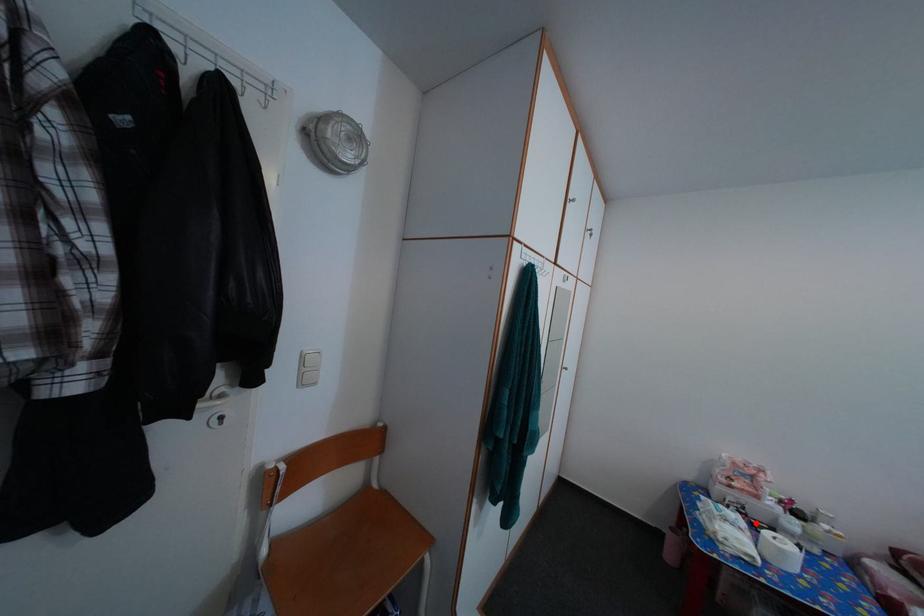
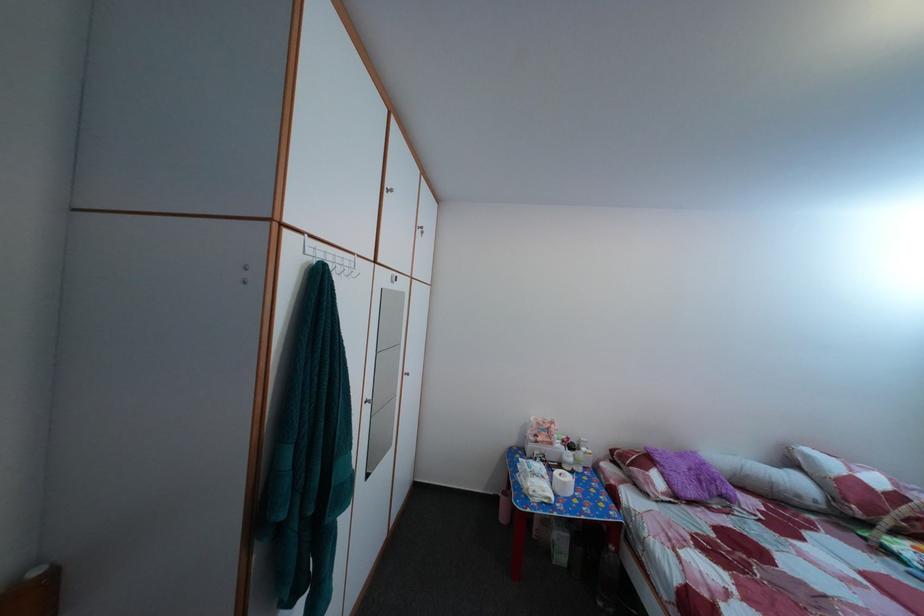
Find the pixel in the second image that matches the highlighted location in the first image.

(555, 469)